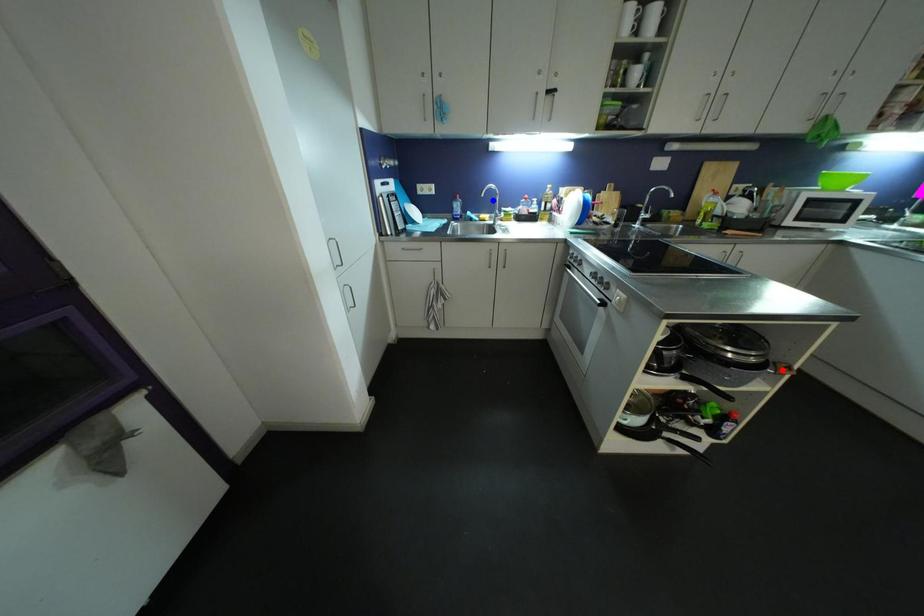
Question: Which of the two points in the image is closer to the camera?

Choices:
 (A) Blue point is closer.
 (B) Red point is closer.

Answer: (B)